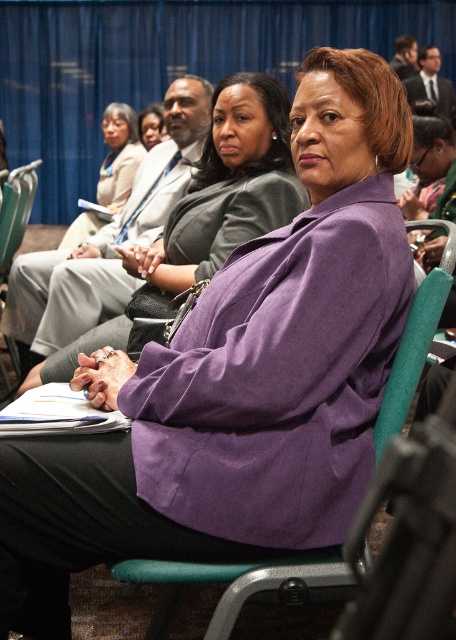
You are standing in the conference room and want to determine which of the two points, point (x=222, y=170) or point (x=398, y=45), is nearer to you. Based on the image, which point is closer?

Point (x=222, y=170) is closer to the camera than point (x=398, y=45), so it is the nearer one.

You are standing in the conference room and want to take a photo of the point at coordinates (x=381, y=422). The camera you have can focus on objects within 1.5 meters. Will the point be in focus?

The point at coordinates (x=381, y=422) is 1.34 meters away from the camera, so it will be within the focus range of 1.5 meters and should be in focus.

You are organizing a seating arrangement for a conference and need to place the teal fabric chair at center and the matte black suit at upper right. Given their sizes, which object requires more space in the seating area?

The matte black suit at upper right requires more space in the seating area because it is larger than the teal fabric chair at center.